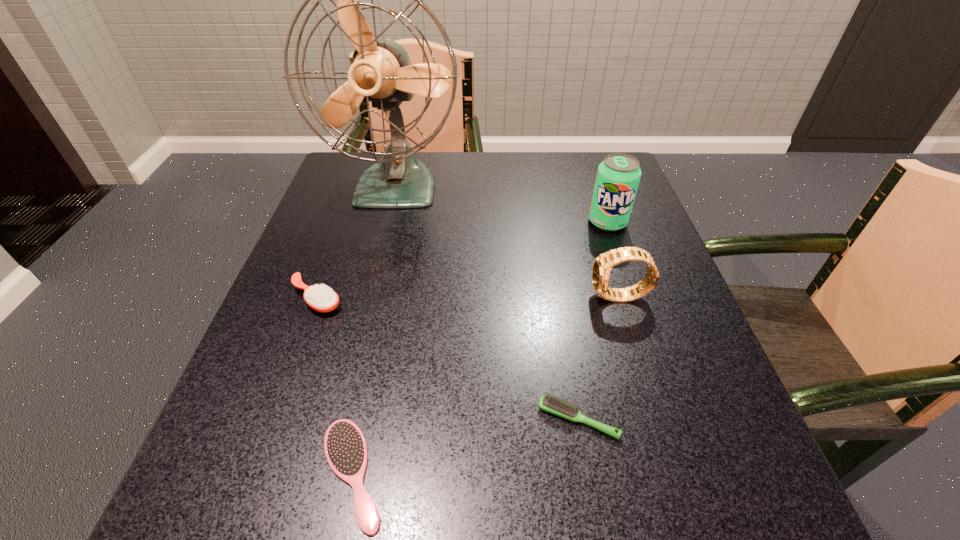
Identify the location of object at the far left corner. The width and height of the screenshot is (960, 540). (381, 71).

At what (x,y) coordinates should I click in order to perform the action: click on object that is at the near left corner. Please return your answer as a coordinate pair (x, y). The image size is (960, 540). Looking at the image, I should click on (345, 447).

The image size is (960, 540). In the image, there is a desktop. What are the coordinates of `vacant space at the near edge` in the screenshot? It's located at (x=433, y=495).

Where is `free space at the left edge of the desktop`? This screenshot has width=960, height=540. free space at the left edge of the desktop is located at coordinates (335, 407).

The image size is (960, 540). What are the coordinates of `vacant position at the right edge of the desktop` in the screenshot? It's located at (651, 238).

Locate an element on the screen. vacant space at the far left corner of the desktop is located at coordinates (363, 173).

In the image, there is a desktop. Where is `blank space at the near left corner`? This screenshot has height=540, width=960. blank space at the near left corner is located at coordinates (178, 531).

At what (x,y) coordinates should I click in order to perform the action: click on vacant space at the far right corner. Please return your answer as a coordinate pair (x, y). Looking at the image, I should click on (565, 179).

Where is `unoccupied area between the watch and the second hairbrush from left to right`? The image size is (960, 540). unoccupied area between the watch and the second hairbrush from left to right is located at coordinates [486, 386].

Find the location of `free space between the rightmost hairbrush and the tallest object`. free space between the rightmost hairbrush and the tallest object is located at coordinates (488, 303).